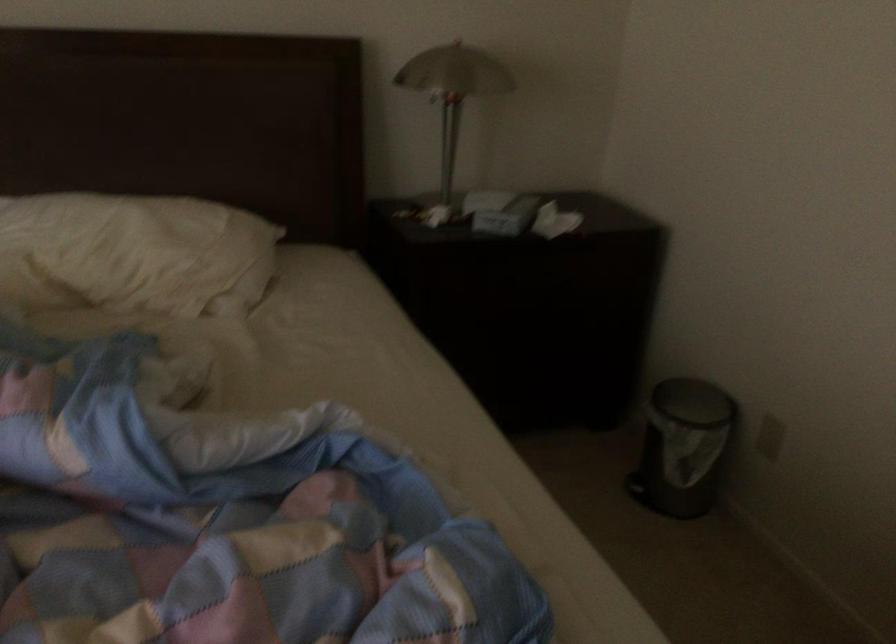
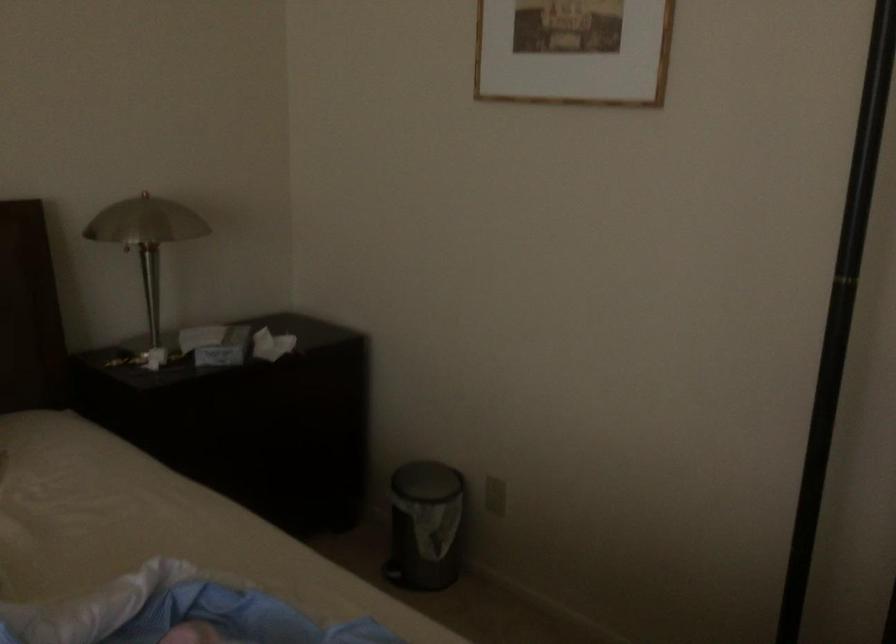
Find the pixel in the second image that matches point (631, 488) in the first image.

(392, 573)